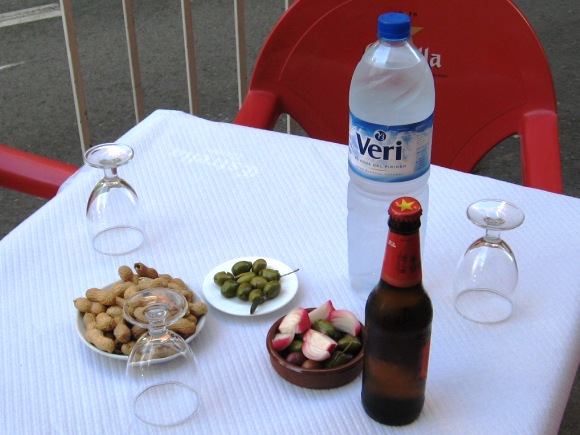
The height and width of the screenshot is (435, 580). Identify the location of glass. (481, 285).